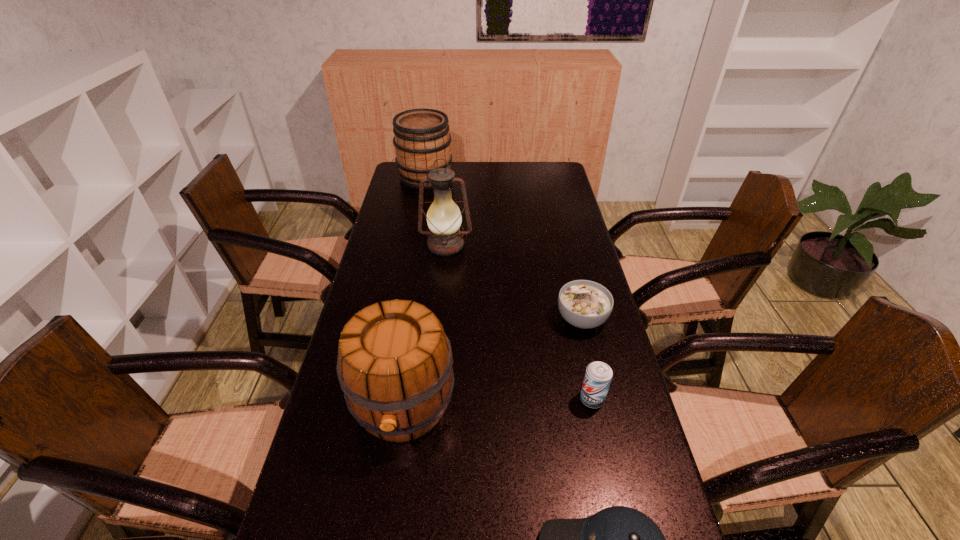
Find the location of a particular element. This screenshot has width=960, height=540. free location located 0.340m on the front of the fourth nearest object is located at coordinates (614, 455).

Find the location of `object at the far edge`. object at the far edge is located at coordinates (422, 136).

Where is `oil lamp located at the left edge`? The width and height of the screenshot is (960, 540). oil lamp located at the left edge is located at coordinates (444, 218).

Image resolution: width=960 pixels, height=540 pixels. I want to click on beer can at the right edge, so pyautogui.click(x=598, y=375).

Identify the location of soup bowl present at the right edge. (585, 304).

At what (x,y) coordinates should I click in order to perform the action: click on object that is positioned at the far left corner. Please return your answer as a coordinate pair (x, y). Looking at the image, I should click on (422, 136).

Identify the location of free space at the far edge of the desktop. (494, 165).

In the image, there is a desktop. Where is `vacant space at the left edge`? This screenshot has width=960, height=540. vacant space at the left edge is located at coordinates (413, 223).

Find the location of a particular element. This screenshot has width=960, height=540. vacant region at the right edge is located at coordinates (543, 189).

Where is `vacant area between the beer can and the nearer cider`? The height and width of the screenshot is (540, 960). vacant area between the beer can and the nearer cider is located at coordinates (497, 402).